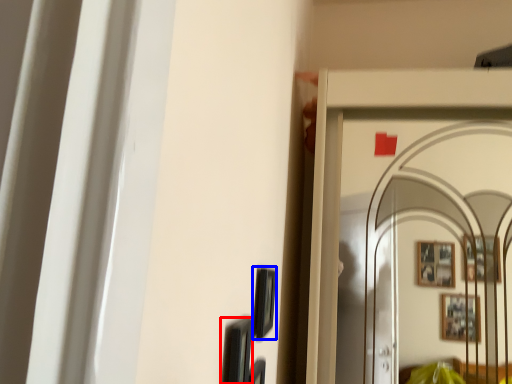
Question: Which object is closer to the camera taking this photo, picture frame (highlighted by a red box) or picture frame (highlighted by a blue box)?

Choices:
 (A) picture frame
 (B) picture frame

Answer: (A)